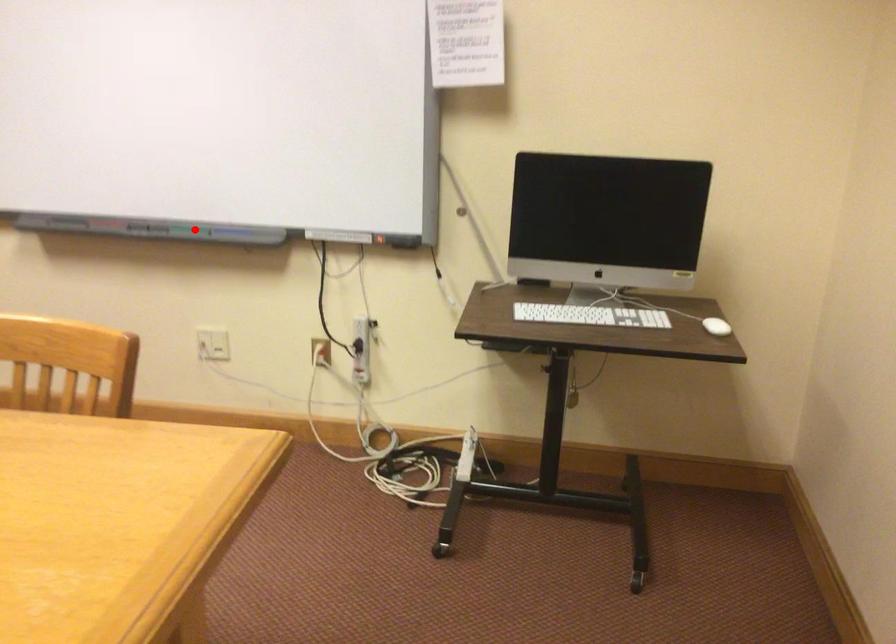
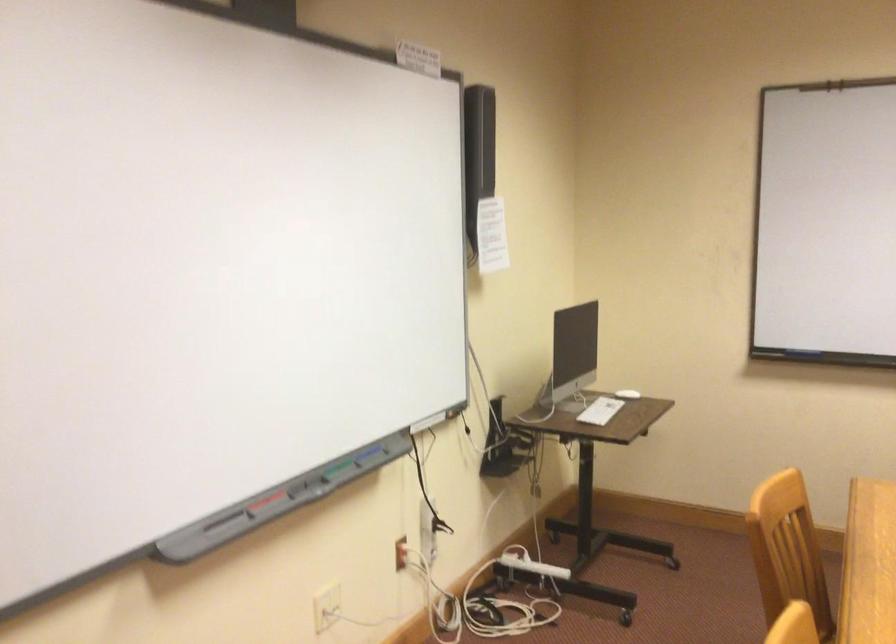
In the second image, find the point that corresponds to the highlighted location in the first image.

(333, 468)